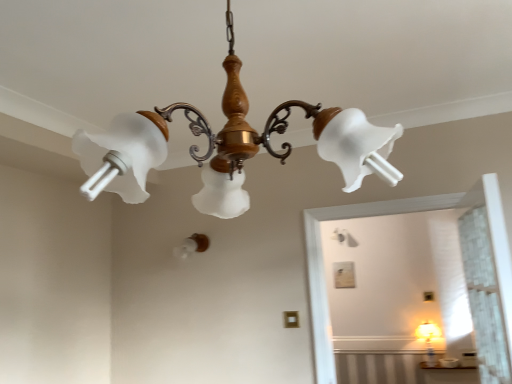
Question: Is matte glass chandelier at upper center, acting as the 1th lamp starting from the top, wider than white frosted bulb at center, the 2th lamp when ordered from top to bottom?

Choices:
 (A) no
 (B) yes

Answer: (B)

Question: Can you confirm if matte glass chandelier at upper center, which is the second lamp in back-to-front order, is taller than white frosted bulb at center, positioned as the 2th lamp in right-to-left order?

Choices:
 (A) no
 (B) yes

Answer: (B)

Question: Is matte glass chandelier at upper center, marked as the second lamp in a bottom-to-top arrangement, not inside white frosted bulb at center, acting as the 1th lamp starting from the back?

Choices:
 (A) yes
 (B) no

Answer: (A)

Question: From a real-world perspective, is matte glass chandelier at upper center, marked as the second lamp in a bottom-to-top arrangement, on top of white frosted bulb at center, the 1th lamp when ordered from bottom to top?

Choices:
 (A) yes
 (B) no

Answer: (A)

Question: Is matte glass chandelier at upper center, acting as the 1th lamp starting from the top, directly adjacent to white frosted bulb at center, which ranks as the 1th lamp in left-to-right order?

Choices:
 (A) yes
 (B) no

Answer: (B)

Question: Is white frosted bulb at center, placed as the second lamp when sorted from front to back, at the back of matte glass chandelier at upper center, which appears as the first lamp when viewed from the right?

Choices:
 (A) yes
 (B) no

Answer: (B)

Question: From the image's perspective, is white frosted bulb at center, the 1th lamp when ordered from bottom to top, below matte glass chandelier at upper center, which is the second lamp in back-to-front order?

Choices:
 (A) no
 (B) yes

Answer: (B)

Question: Is white frosted bulb at center, which ranks as the 1th lamp in left-to-right order, smaller than matte glass chandelier at upper center, which is the second lamp in back-to-front order?

Choices:
 (A) yes
 (B) no

Answer: (A)

Question: Would you say white frosted bulb at center, positioned as the 2th lamp in right-to-left order, is a long distance from matte glass chandelier at upper center, which appears as the first lamp when viewed from the right?

Choices:
 (A) no
 (B) yes

Answer: (B)

Question: Considering the relative sizes of white frosted bulb at center, which ranks as the 1th lamp in left-to-right order, and matte glass chandelier at upper center, the 1th lamp when ordered from front to back, in the image provided, is white frosted bulb at center, which ranks as the 1th lamp in left-to-right order, thinner than matte glass chandelier at upper center, the 1th lamp when ordered from front to back,?

Choices:
 (A) no
 (B) yes

Answer: (B)

Question: From a real-world perspective, is white frosted bulb at center, the 1th lamp when ordered from bottom to top, beneath matte glass chandelier at upper center, marked as the second lamp in a bottom-to-top arrangement?

Choices:
 (A) yes
 (B) no

Answer: (A)

Question: From a real-world perspective, is white frosted bulb at center, positioned as the 2th lamp in right-to-left order, physically above matte glass chandelier at upper center, marked as the second lamp in a bottom-to-top arrangement?

Choices:
 (A) yes
 (B) no

Answer: (B)

Question: From a real-world perspective, is matte glass chandelier at upper center, marked as the second lamp in a bottom-to-top arrangement, positioned above or below white frosted bulb at center, placed as the second lamp when sorted from front to back?

Choices:
 (A) above
 (B) below

Answer: (A)